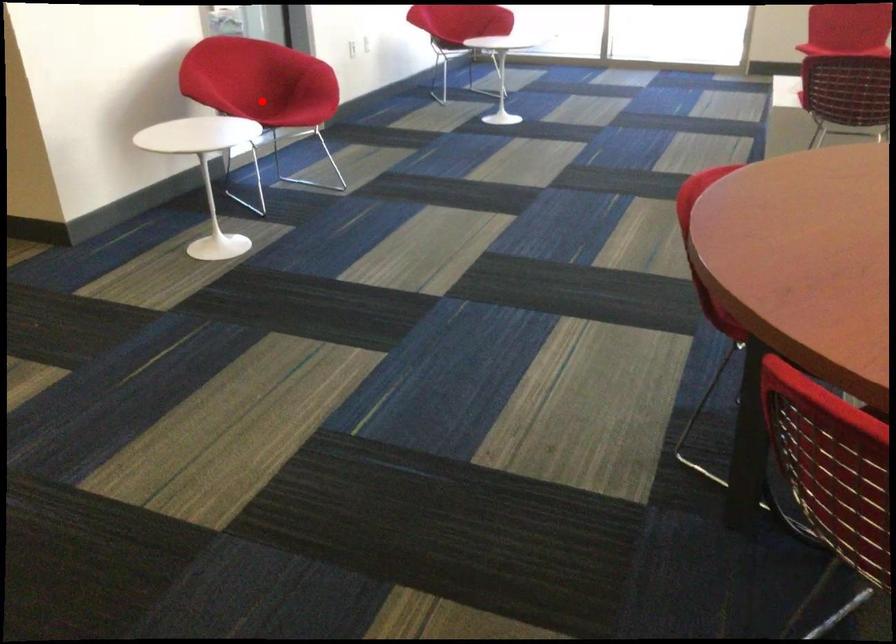
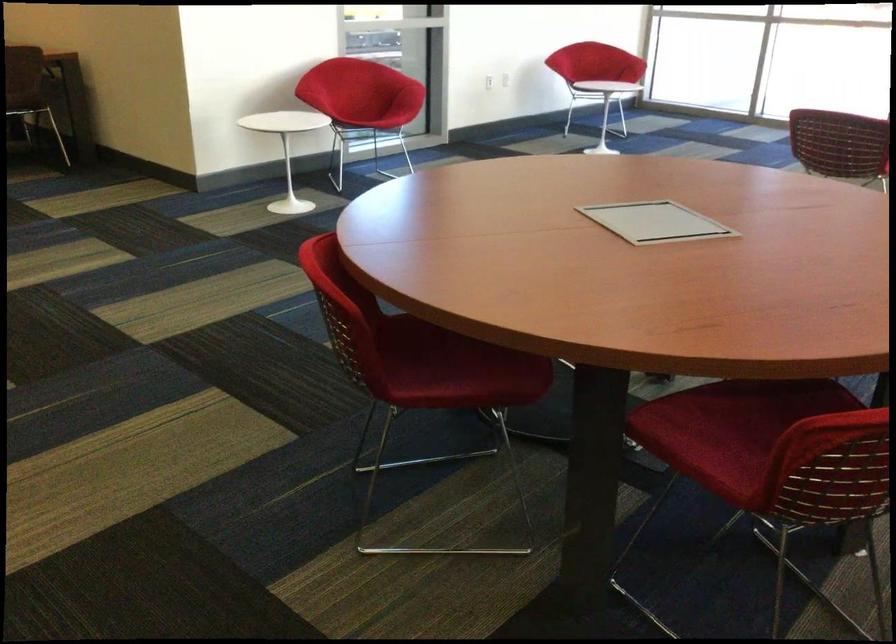
Question: I am providing you with two images of the same scene from different viewpoints. In image1, a red point is highlighted. Considering the same 3D point in image2, which of the following is correct?

Choices:
 (A) It is closer
 (B) It is farther

Answer: (B)